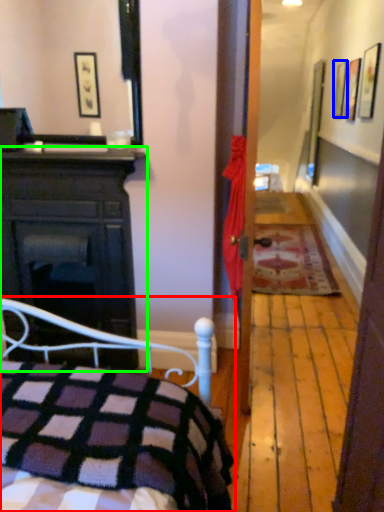
Question: Estimate the real-world distances between objects in this image. Which object is farther from bed (highlighted by a red box), picture frame (highlighted by a blue box) or cabinetry (highlighted by a green box)?

Choices:
 (A) picture frame
 (B) cabinetry

Answer: (A)